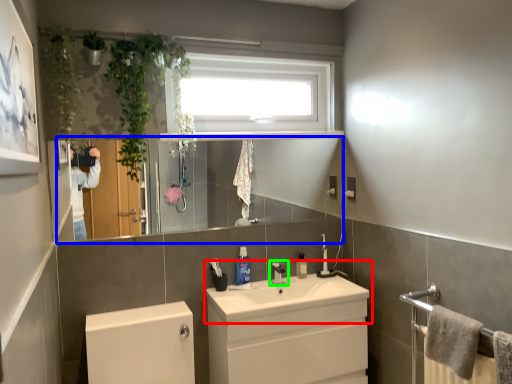
Question: Which object is the closest to the sink (highlighted by a red box)? Choose among these: mirror (highlighted by a blue box) or tap (highlighted by a green box).

Choices:
 (A) mirror
 (B) tap

Answer: (B)